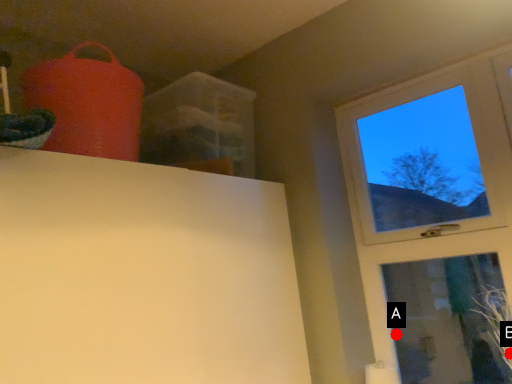
Question: Two points are circled on the image, labeled by A and B beside each circle. Which point is farther from the camera taking this photo?

Choices:
 (A) A is further
 (B) B is further

Answer: (A)